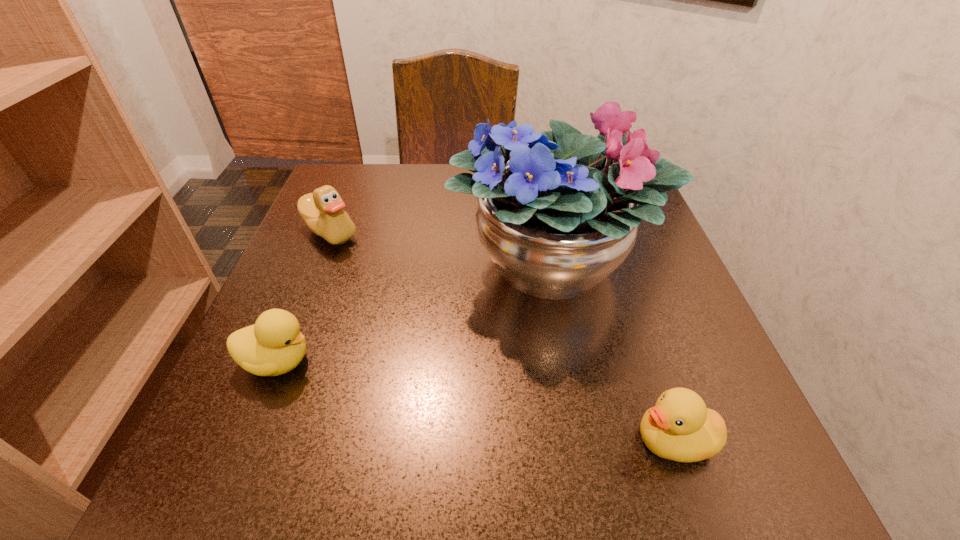
The height and width of the screenshot is (540, 960). In the image, there is a desktop. In order to click on vacant region at the near edge in this screenshot , I will do `click(488, 456)`.

Locate an element on the screen. free spot at the left edge of the desktop is located at coordinates (370, 248).

Where is `free space at the right edge`? free space at the right edge is located at coordinates (657, 390).

Where is `free point at the far left corner`? This screenshot has width=960, height=540. free point at the far left corner is located at coordinates (343, 197).

This screenshot has width=960, height=540. I want to click on empty space between the farthest duck and the nearest object, so [502, 336].

Image resolution: width=960 pixels, height=540 pixels. What are the coordinates of `free space between the second nearest duck and the tallest object` in the screenshot? It's located at (415, 312).

Locate an element on the screen. This screenshot has height=540, width=960. free space between the tallest object and the third farthest object is located at coordinates (415, 312).

Locate an element on the screen. vacant area between the nearest duck and the farthest duck is located at coordinates (502, 336).

Identify the location of free space between the bouquet and the second farthest duck. (415, 312).

In order to click on free space between the nearest object and the farthest duck in this screenshot , I will do `click(502, 336)`.